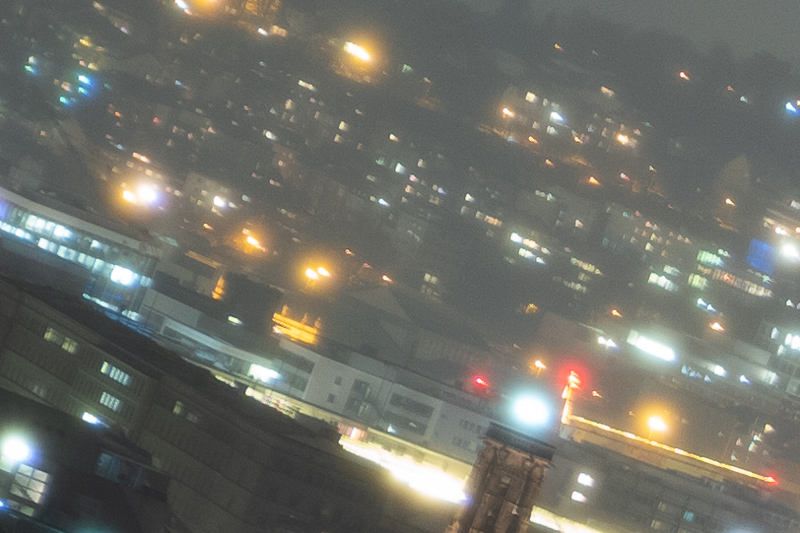
Find the location of a particular element. yellow light is located at coordinates click(312, 282), click(320, 269), click(258, 247), click(358, 51), click(134, 193), click(661, 428).